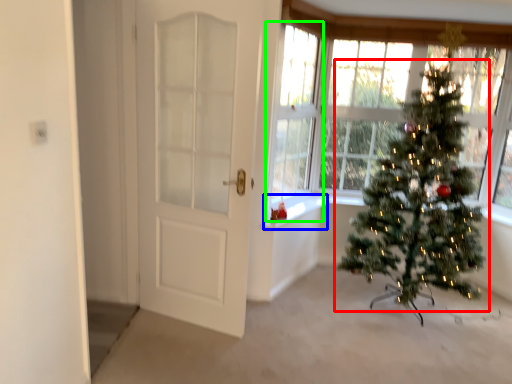
Question: Which object is positioned farthest from christmas tree (highlighted by a red box)? Select from window sill (highlighted by a blue box) and window (highlighted by a green box).

Choices:
 (A) window sill
 (B) window

Answer: (B)